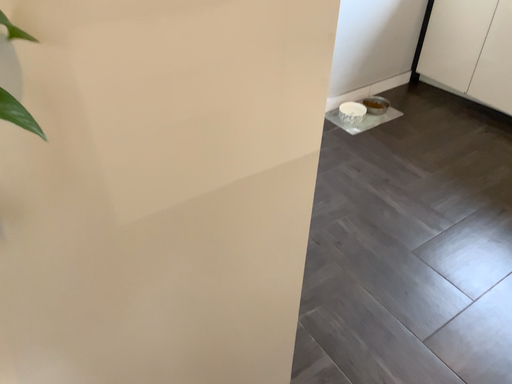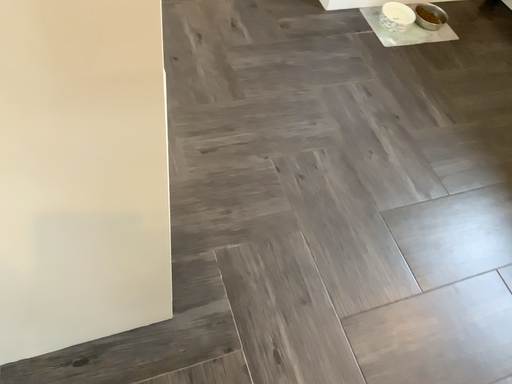
Question: Which way did the camera rotate in the video?

Choices:
 (A) rotated right
 (B) rotated left

Answer: (B)